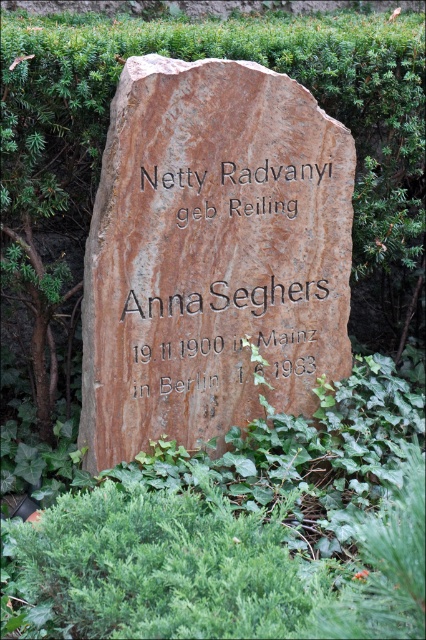
You are standing in front of the tombstone and want to place a flower bouquet at the point marked as point (244, 362). If your arm reaches 10 feet, can you reach that point without moving closer?

The distance of point (244, 362) from viewer is 10.64 feet, so you cannot reach it with an arm that only extends 10 feet. You need to move closer.

You are standing in a cemetery and want to take a photo of the brown stone boulder at center. If your camera has a minimum focusing distance of 10 feet, will you need to step back to take a clear photo?

The distance between you and the brown stone boulder at center is 9.42 feet, which is less than the camera minimum focusing distance of 10 feet. Therefore, you need to step back to ensure the camera can focus properly.

You are standing in a cemetery and want to read the inscription on the matte stone inscription at center. There is a brown stone boulder at center blocking your view. Can you see the inscription clearly?

The brown stone boulder at center is in front of the matte stone inscription at center, so it is blocking your view. You cannot see the inscription clearly.